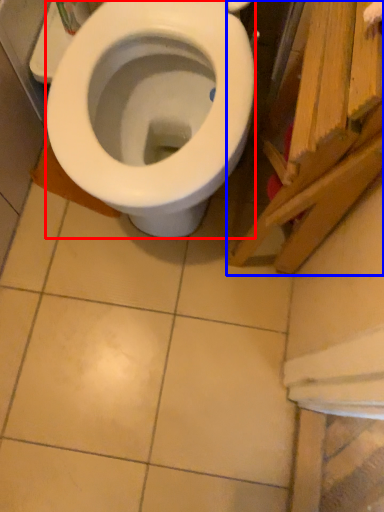
Question: Which object appears closest to the camera in this image, bidet (highlighted by a red box) or wood (highlighted by a blue box)?

Choices:
 (A) bidet
 (B) wood

Answer: (B)